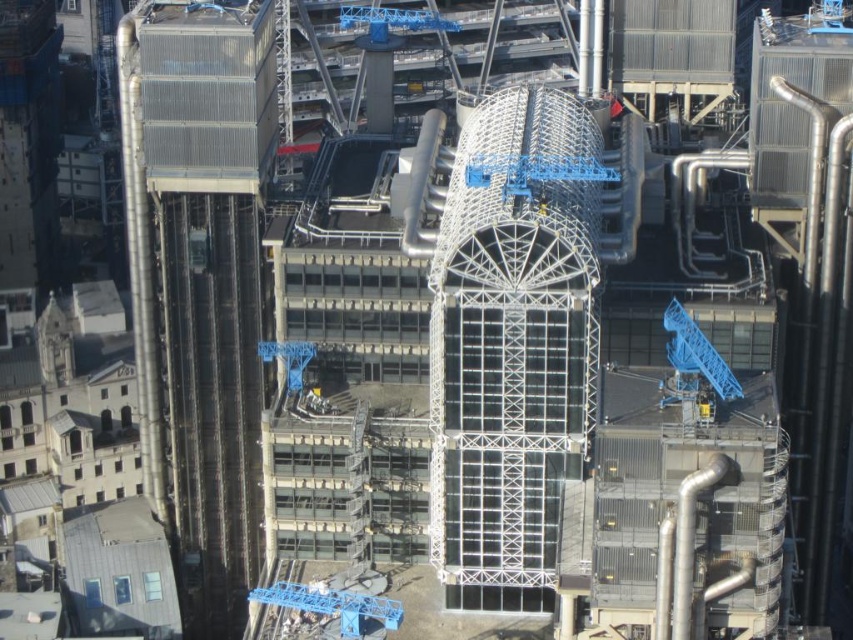
Which is behind, point (213, 260) or point (403, 22)?

The point (403, 22) is behind.

Is metallic glass tower at left behind blue metallic crane at upper center?

No, metallic glass tower at left is in front of blue metallic crane at upper center.

The height and width of the screenshot is (640, 853). Find the location of `metallic glass tower at left`. metallic glass tower at left is located at coordinates (199, 282).

The width and height of the screenshot is (853, 640). Find the location of `transparent glass tower at center`. transparent glass tower at center is located at coordinates (514, 342).

Identify the location of transparent glass tower at center. This screenshot has width=853, height=640. (514, 342).

Find the location of a particular element. This screenshot has height=640, width=853. transparent glass tower at center is located at coordinates (514, 342).

This screenshot has height=640, width=853. Describe the element at coordinates (199, 282) in the screenshot. I see `metallic glass tower at left` at that location.

Between metallic glass tower at left and transparent glass tower at center, which one has less height?

transparent glass tower at center is shorter.

Is point (155, 320) more distant than point (485, 352)?

That is True.

You are a GUI agent. You are given a task and a screenshot of the screen. Output one action in this format:
    pyautogui.click(x=<x>, y=<y>)
    Task: Click on the metallic glass tower at left
    Image resolution: width=853 pixels, height=640 pixels.
    Given the screenshot: What is the action you would take?
    [x=199, y=282]